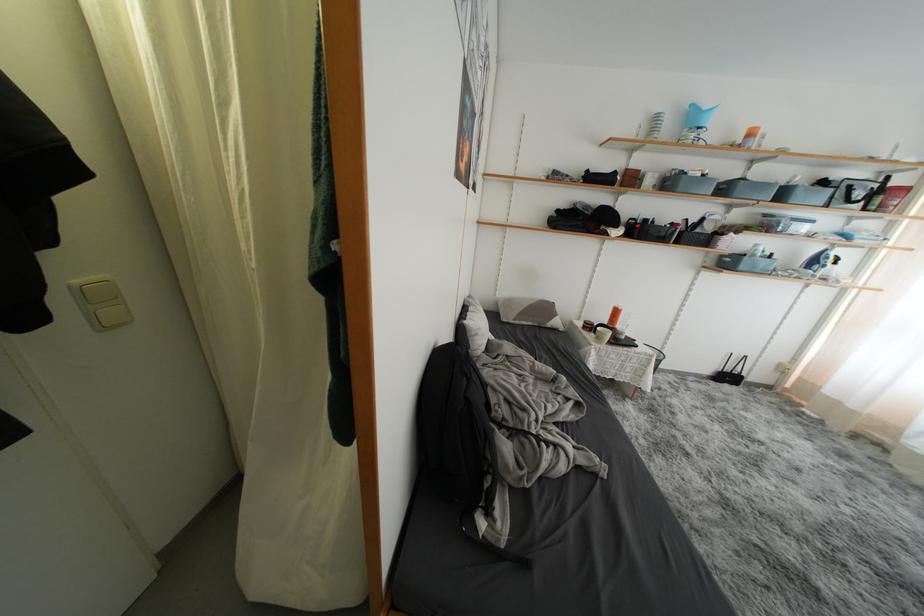
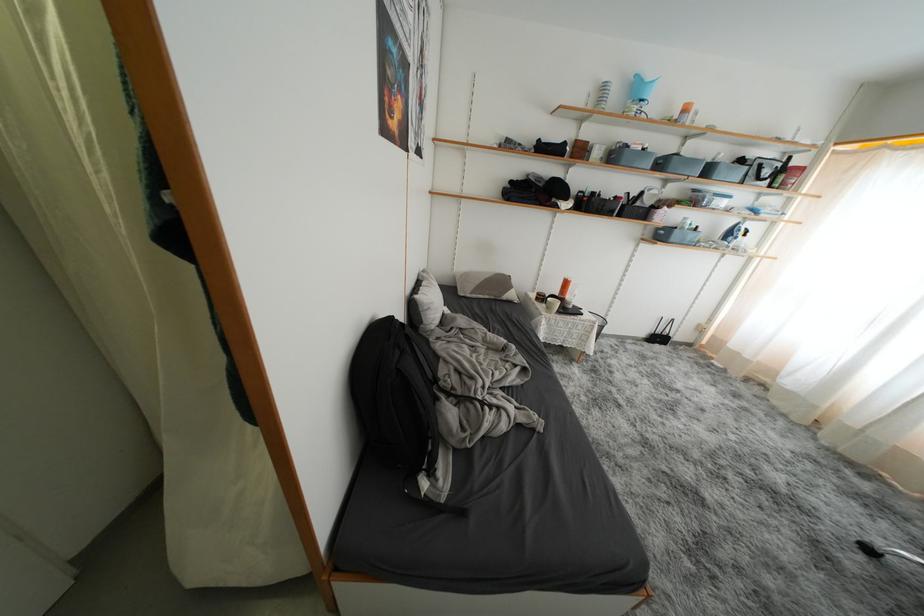
The point at (470,385) is marked in the first image. Where is the corresponding point in the second image?

(404, 357)